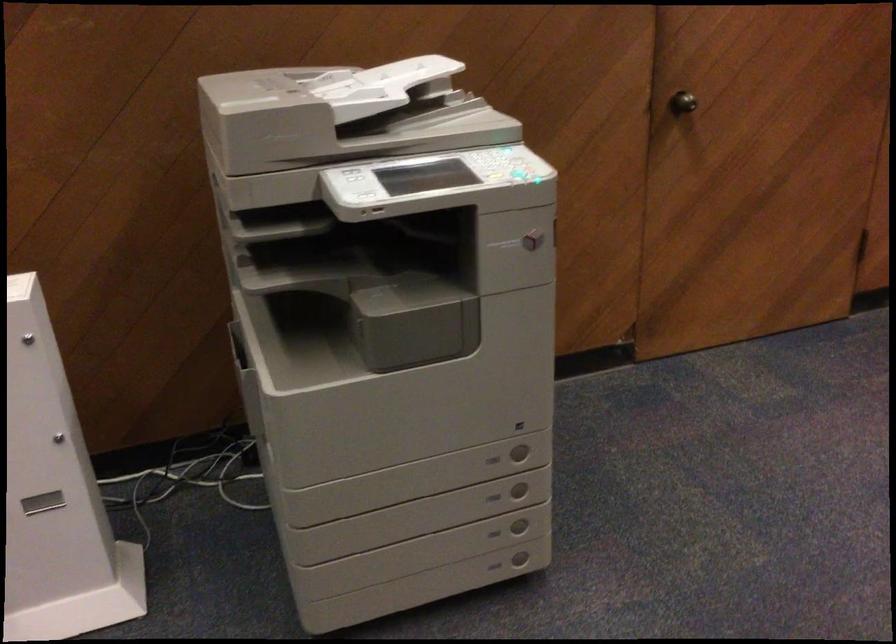
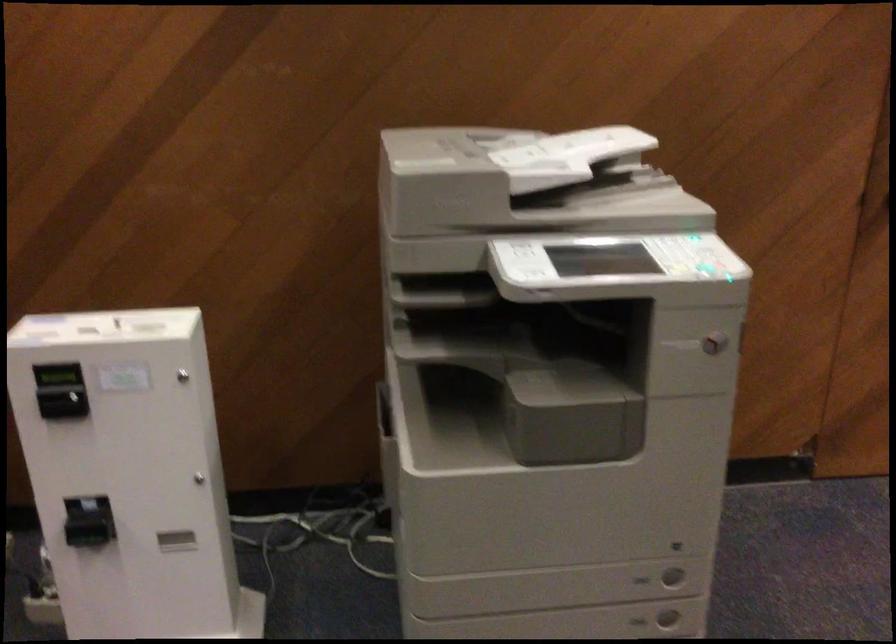
The point at [533,243] is marked in the first image. Where is the corresponding point in the second image?

(713, 343)